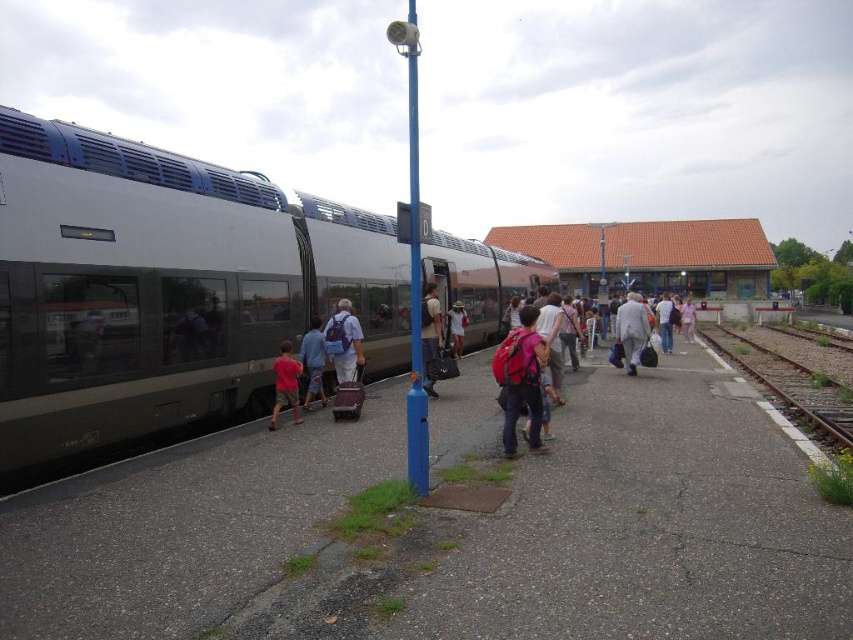
Question: Is matte red shirt at center thinner than light gray backpack at center?

Choices:
 (A) yes
 (B) no

Answer: (A)

Question: Does white cloth bag at center have a greater width compared to pink fabric dress at center?

Choices:
 (A) no
 (B) yes

Answer: (B)

Question: Which is nearer to the pink backpack at center?

Choices:
 (A) denim jacket at center
 (B) pink fabric dress at center

Answer: (A)

Question: Does white cloth bag at center appear under matte red shirt at center?

Choices:
 (A) no
 (B) yes

Answer: (A)

Question: Which point is farther to the camera?

Choices:
 (A) light blue backpack at center
 (B) denim jacket at center

Answer: (B)

Question: Which point is farther to the camera?

Choices:
 (A) light gray backpack at center
 (B) matte red shirt at center
 (C) metal train track at right
 (D) pink fabric dress at center

Answer: (D)